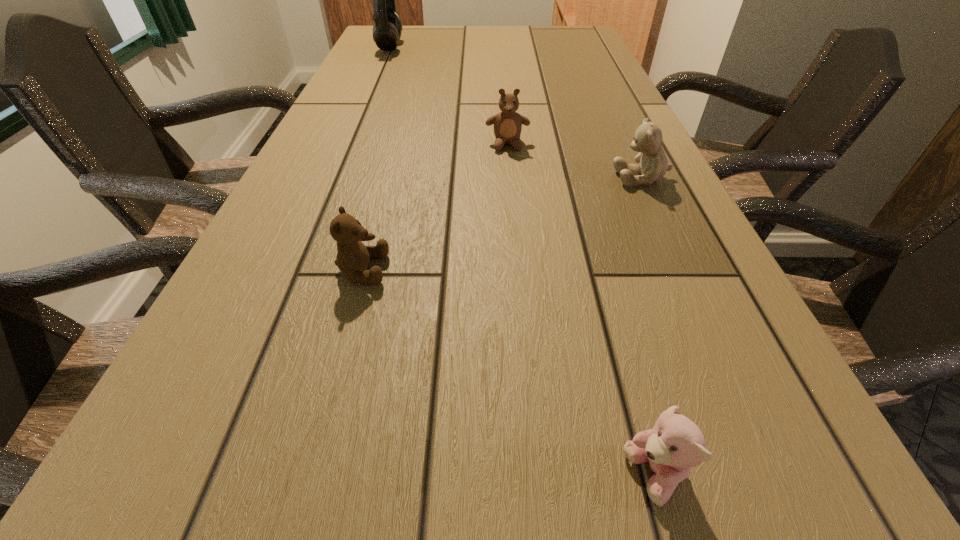
Locate an element on the screen. free space between the nearest object and the rightmost object is located at coordinates (648, 327).

At what (x,y) coordinates should I click in order to perform the action: click on free space between the second nearest object and the headset. Please return your answer as a coordinate pair (x, y). This screenshot has height=540, width=960. Looking at the image, I should click on (376, 158).

Find the location of a particular element. empty space that is in between the second nearest object and the third object from right to left is located at coordinates (435, 207).

This screenshot has width=960, height=540. Find the location of `vacant region between the rightmost object and the second nearest object`. vacant region between the rightmost object and the second nearest object is located at coordinates (502, 224).

Identify the location of unoccupied area between the nearest teddy bear and the third teddy bear from right to left. (581, 310).

At what (x,y) coordinates should I click in order to perform the action: click on free spot between the second nearest teddy bear and the third nearest teddy bear. Please return your answer as a coordinate pair (x, y). Looking at the image, I should click on (502, 224).

Identify which object is the nearest to the farthest object. Please provide its 2D coordinates. Your answer should be formatted as a tuple, i.e. [(x, y)], where the tuple contains the x and y coordinates of a point satisfying the conditions above.

[(507, 124)]

This screenshot has width=960, height=540. Identify the location of the third closest object relative to the third nearest object. (675, 444).

Locate an element on the screen. the closest teddy bear to the farthest object is located at coordinates (507, 124).

Locate an element on the screen. teddy bear that stands as the third closest to the rightmost object is located at coordinates (675, 444).